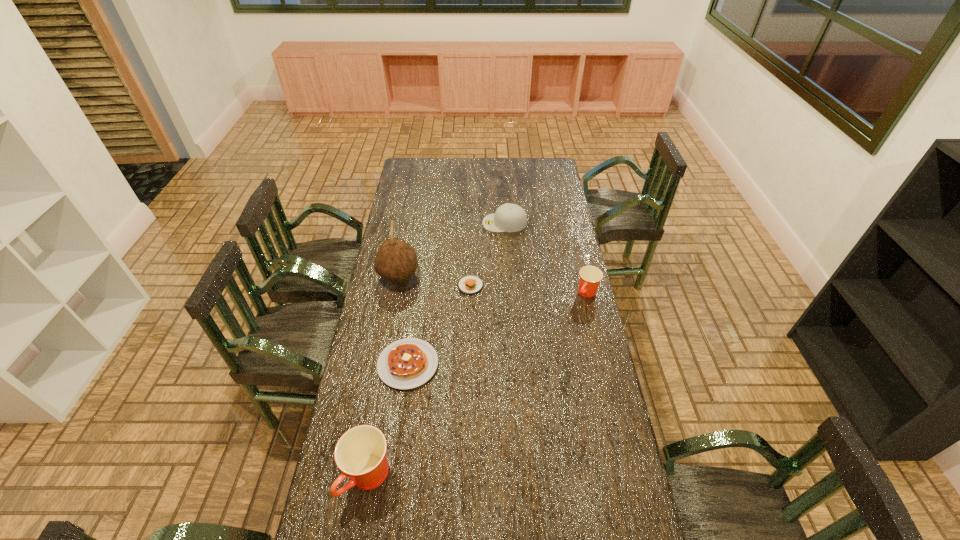
Identify the location of free spot between the farthest object and the pancake. (456, 294).

At what (x,y) coordinates should I click in order to perform the action: click on unoccupied area between the cap and the coconut. Please return your answer as a coordinate pair (x, y). The height and width of the screenshot is (540, 960). Looking at the image, I should click on (452, 250).

Identify the location of unoccupied position between the nearer cup and the farther cup. The image size is (960, 540). (478, 385).

This screenshot has height=540, width=960. What are the coordinates of `free space between the farther cup and the taller cup` in the screenshot? It's located at (478, 385).

Where is `empty space that is in between the coconut and the rightmost object`? The height and width of the screenshot is (540, 960). empty space that is in between the coconut and the rightmost object is located at coordinates (493, 285).

In order to click on vacant space that is in between the food and the pancake in this screenshot , I will do `click(439, 325)`.

Locate an element on the screen. Image resolution: width=960 pixels, height=540 pixels. vacant area that lies between the second nearest object and the farther cup is located at coordinates (497, 329).

At what (x,y) coordinates should I click in order to perform the action: click on free space between the farther cup and the shortest object. Please return your answer as a coordinate pair (x, y). Looking at the image, I should click on (529, 289).

Identify which object is the third nearest to the shortest object. Please provide its 2D coordinates. Your answer should be formatted as a tuple, i.e. [(x, y)], where the tuple contains the x and y coordinates of a point satisfying the conditions above.

[(508, 217)]

Locate an element on the screen. The width and height of the screenshot is (960, 540). object that is the fourth closest one to the coconut is located at coordinates (590, 276).